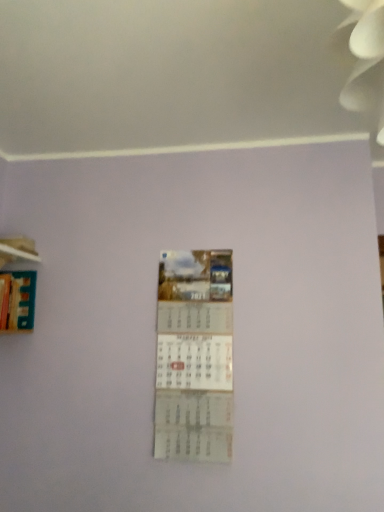
Question: Could you tell me if wooden at left is facing hardcover book at left?

Choices:
 (A) yes
 (B) no

Answer: (B)

Question: Can you confirm if wooden at left is taller than hardcover book at left?

Choices:
 (A) yes
 (B) no

Answer: (B)

Question: Is wooden at left positioned with its back to hardcover book at left?

Choices:
 (A) yes
 (B) no

Answer: (B)

Question: Does wooden at left lie in front of hardcover book at left?

Choices:
 (A) no
 (B) yes

Answer: (A)

Question: From the image's perspective, is wooden at left located above hardcover book at left?

Choices:
 (A) yes
 (B) no

Answer: (A)

Question: Does wooden at left come behind hardcover book at left?

Choices:
 (A) yes
 (B) no

Answer: (A)

Question: From the image's perspective, is hardcover book at left below white paper calendar at center?

Choices:
 (A) no
 (B) yes

Answer: (A)

Question: Does hardcover book at left come behind white paper calendar at center?

Choices:
 (A) yes
 (B) no

Answer: (B)

Question: Is hardcover book at left far away from white paper calendar at center?

Choices:
 (A) no
 (B) yes

Answer: (A)

Question: Is hardcover book at left smaller than white paper calendar at center?

Choices:
 (A) no
 (B) yes

Answer: (A)

Question: Is hardcover book at left not inside white paper calendar at center?

Choices:
 (A) no
 (B) yes

Answer: (B)

Question: Can you confirm if hardcover book at left is positioned to the right of white paper calendar at center?

Choices:
 (A) no
 (B) yes

Answer: (A)

Question: Does white paper calendar at center have a lesser width compared to hardcover book at left?

Choices:
 (A) no
 (B) yes

Answer: (B)